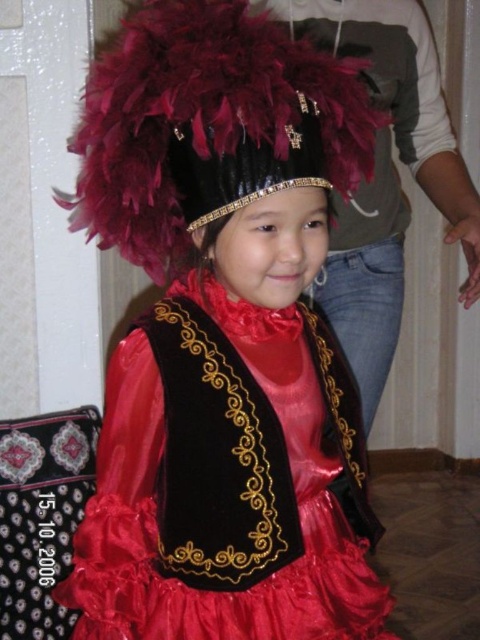
Who is positioned more to the left, velvet satin dress at center or feathered black headdress at upper center?

From the viewer's perspective, feathered black headdress at upper center appears more on the left side.

Can you confirm if velvet satin dress at center is thinner than feathered black headdress at upper center?

No, velvet satin dress at center is not thinner than feathered black headdress at upper center.

The width and height of the screenshot is (480, 640). What are the coordinates of `velvet satin dress at center` in the screenshot? It's located at (226, 483).